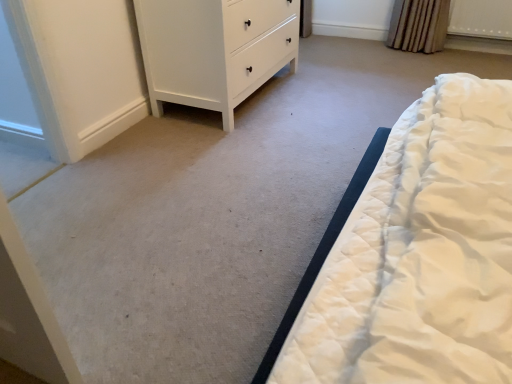
Question: Should I look upward or downward to see white plastic radiator at upper right?

Choices:
 (A) up
 (B) down

Answer: (A)

Question: From a real-world perspective, is white plastic radiator at upper right positioned under white matte chest of drawers at upper left based on gravity?

Choices:
 (A) no
 (B) yes

Answer: (B)

Question: Does white plastic radiator at upper right come in front of white matte chest of drawers at upper left?

Choices:
 (A) yes
 (B) no

Answer: (B)

Question: Is white plastic radiator at upper right touching white matte chest of drawers at upper left?

Choices:
 (A) yes
 (B) no

Answer: (B)

Question: Considering the relative sizes of white plastic radiator at upper right and white matte chest of drawers at upper left in the image provided, is white plastic radiator at upper right smaller than white matte chest of drawers at upper left?

Choices:
 (A) yes
 (B) no

Answer: (A)

Question: Is white plastic radiator at upper right thinner than white matte chest of drawers at upper left?

Choices:
 (A) yes
 (B) no

Answer: (A)

Question: Does white plastic radiator at upper right have a greater height compared to white matte chest of drawers at upper left?

Choices:
 (A) no
 (B) yes

Answer: (A)

Question: Could white plastic radiator at upper right be considered to be inside white matte chest of drawers at upper left?

Choices:
 (A) yes
 (B) no

Answer: (B)

Question: Is the position of white matte chest of drawers at upper left less distant than that of white plastic radiator at upper right?

Choices:
 (A) yes
 (B) no

Answer: (A)

Question: Is white matte chest of drawers at upper left aimed at white plastic radiator at upper right?

Choices:
 (A) no
 (B) yes

Answer: (A)

Question: Can you confirm if white matte chest of drawers at upper left is wider than white plastic radiator at upper right?

Choices:
 (A) yes
 (B) no

Answer: (A)

Question: Can you confirm if white matte chest of drawers at upper left is bigger than white plastic radiator at upper right?

Choices:
 (A) no
 (B) yes

Answer: (B)

Question: Is white matte chest of drawers at upper left to the left of white plastic radiator at upper right from the viewer's perspective?

Choices:
 (A) no
 (B) yes

Answer: (B)

Question: Would you say white matte chest of drawers at upper left is inside or outside white plastic radiator at upper right?

Choices:
 (A) inside
 (B) outside

Answer: (B)